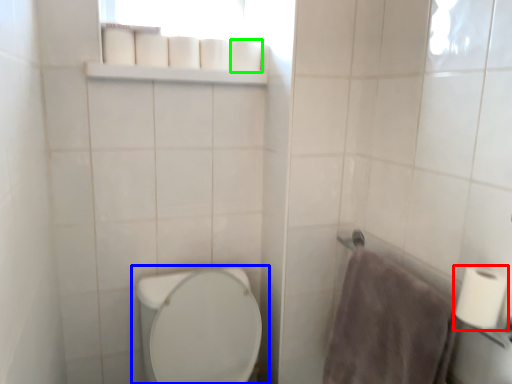
Question: Estimate the real-world distances between objects in this image. Which object is closer to toilet paper (highlighted by a red box), toilet (highlighted by a blue box) or toilet paper (highlighted by a green box)?

Choices:
 (A) toilet
 (B) toilet paper

Answer: (A)